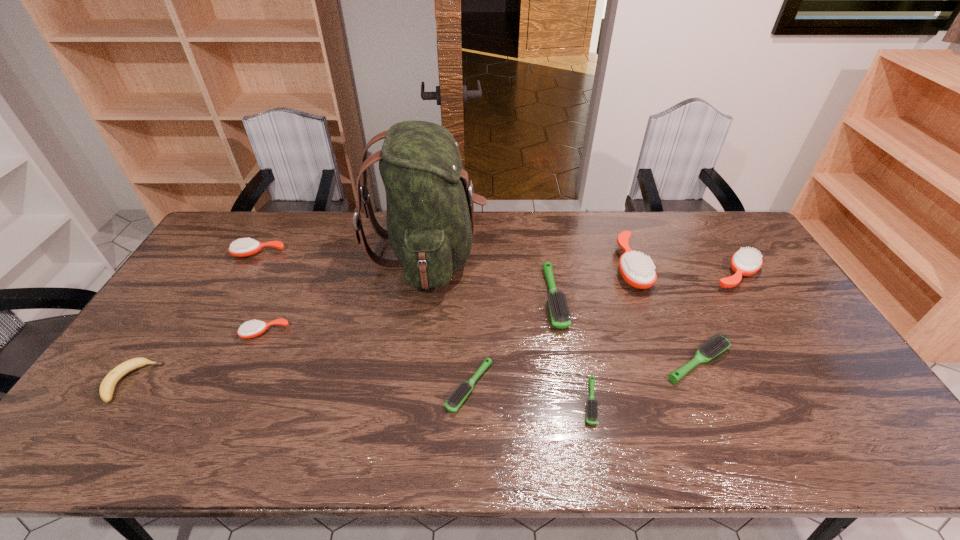
Locate an element on the screen. Image resolution: width=960 pixels, height=540 pixels. empty location between the nearest orange hairbrush and the third biggest orange hairbrush is located at coordinates (262, 293).

You are a GUI agent. You are given a task and a screenshot of the screen. Output one action in this format:
    pyautogui.click(x=<x>, y=<y>)
    Task: Click on the blank region between the third smallest light hairbrush and the smallest light hairbrush
    The height and width of the screenshot is (540, 960).
    Given the screenshot: What is the action you would take?
    [644, 382]

Locate an element on the screen. empty location between the rightmost hairbrush and the banana is located at coordinates coord(434,328).

This screenshot has height=540, width=960. I want to click on vacant point located between the smallest orange hairbrush and the yellow banana, so 199,357.

Locate an element on the screen. This screenshot has width=960, height=540. vacant space that's between the sixth hairbrush from right to left and the banana is located at coordinates (300, 384).

Locate an element on the screen. The width and height of the screenshot is (960, 540). vacant area that lies between the ninth shortest object and the tallest object is located at coordinates (528, 260).

I want to click on empty space between the rightmost light hairbrush and the rightmost object, so click(x=716, y=318).

Where is `object that is the fifth nearest to the rightmost light hairbrush`? The width and height of the screenshot is (960, 540). object that is the fifth nearest to the rightmost light hairbrush is located at coordinates tap(456, 399).

Identify which object is the fourth closest to the sixth hairbrush from right to left. Please provide its 2D coordinates. Your answer should be formatted as a tuple, i.e. [(x, y)], where the tuple contains the x and y coordinates of a point satisfying the conditions above.

[(718, 343)]

The height and width of the screenshot is (540, 960). In order to click on hairbrush object that ranks as the second closest to the third biggest orange hairbrush in this screenshot , I will do `click(456, 399)`.